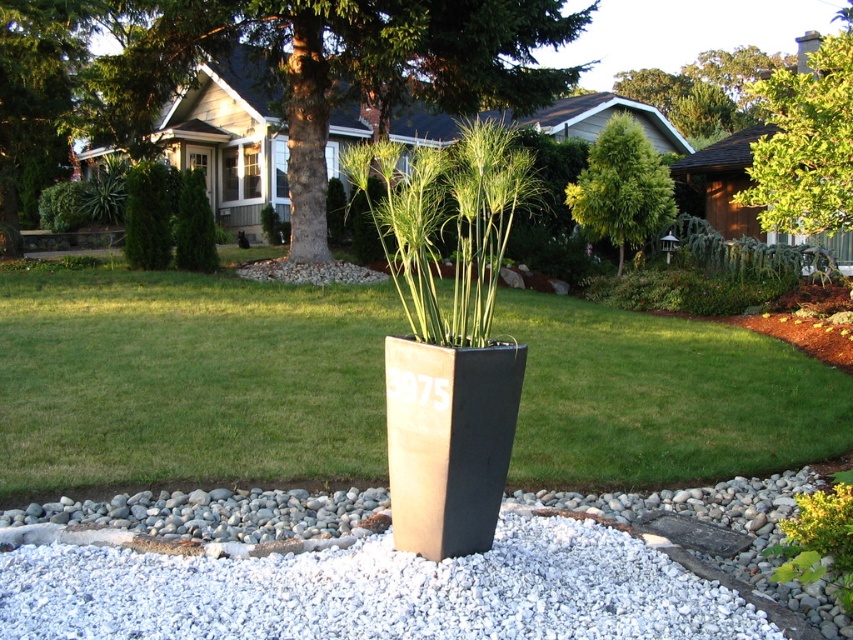
Does white gravel at center appear over green textured tree at center?

No, white gravel at center is not above green textured tree at center.

Which is behind, point (231, 598) or point (117, 93)?

The point (117, 93) is more distant.

Locate an element on the screen. This screenshot has height=640, width=853. white gravel at center is located at coordinates [376, 592].

Between green textured tree at center and green textured tree at upper center, which one is positioned lower?

green textured tree at upper center

The image size is (853, 640). What do you see at coordinates (271, 70) in the screenshot? I see `green textured tree at center` at bounding box center [271, 70].

Identify the location of green textured tree at center. The image size is (853, 640). (271, 70).

Is point (724, 634) closer to camera compared to point (606, 168)?

Yes.

Is white gravel at center further to the viewer compared to green textured tree at upper center?

No, white gravel at center is closer to the viewer.

What are the coordinates of `white gravel at center` in the screenshot? It's located at (376, 592).